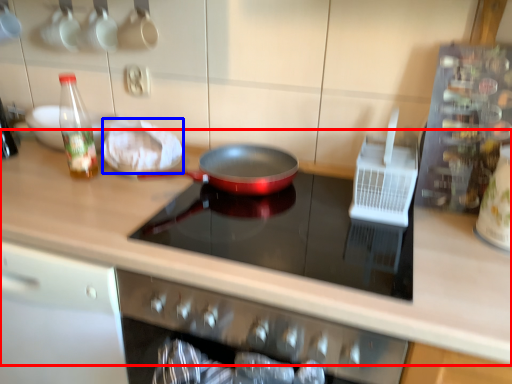
Question: Which point is closer to the camera, countertop (highlighted by a red box) or food (highlighted by a blue box)?

Choices:
 (A) countertop
 (B) food

Answer: (A)